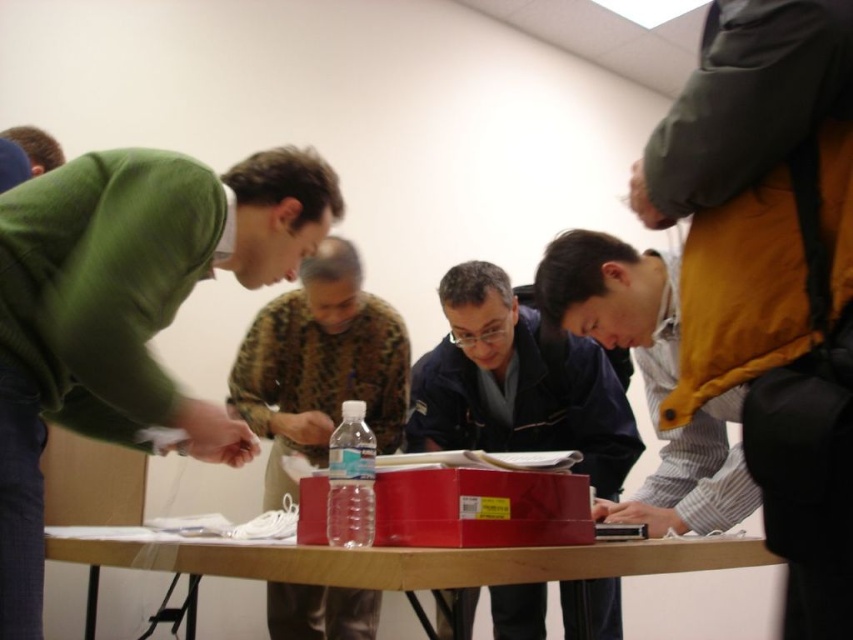
Question: Observing the image, what is the correct spatial positioning of camouflage fabric shirt at center in reference to clear plastic bottle at center?

Choices:
 (A) above
 (B) below

Answer: (A)

Question: Among these points, which one is nearest to the camera?

Choices:
 (A) (575, 401)
 (B) (67, 531)
 (C) (367, 333)
 (D) (334, 465)

Answer: (D)

Question: Estimate the real-world distances between objects in this image. Which object is farther from the camouflage fabric shirt at center?

Choices:
 (A) wooden table at center
 (B) matte black jacket at center
 (C) clear plastic bottle at center

Answer: (C)

Question: Which of the following is the closest to the observer?

Choices:
 (A) green matte sweater at left
 (B) camouflage fabric shirt at center

Answer: (A)

Question: Is matte black jacket at center below clear plastic bottle at center?

Choices:
 (A) no
 (B) yes

Answer: (A)

Question: Does green matte sweater at left have a greater width compared to wooden table at center?

Choices:
 (A) no
 (B) yes

Answer: (A)